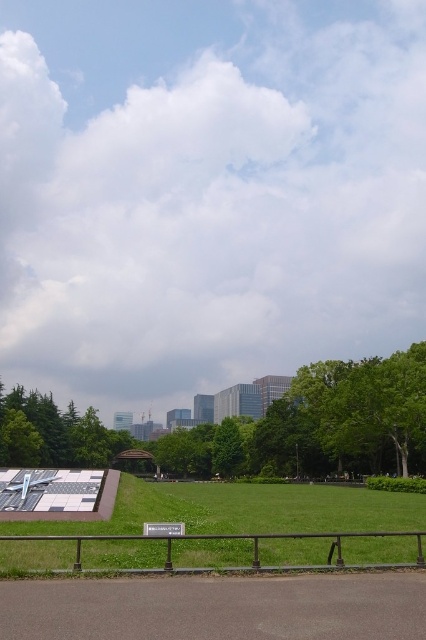
Question: Does green grass at center have a larger size compared to green leafy tree at center?

Choices:
 (A) yes
 (B) no

Answer: (A)

Question: Which point appears farthest from the camera in this image?

Choices:
 (A) click(206, 564)
 (B) click(235, 436)

Answer: (B)

Question: Is green grass at center to the left of green leafy tree at center from the viewer's perspective?

Choices:
 (A) no
 (B) yes

Answer: (A)

Question: Does green grass at center have a smaller size compared to green leafy tree at center?

Choices:
 (A) no
 (B) yes

Answer: (A)